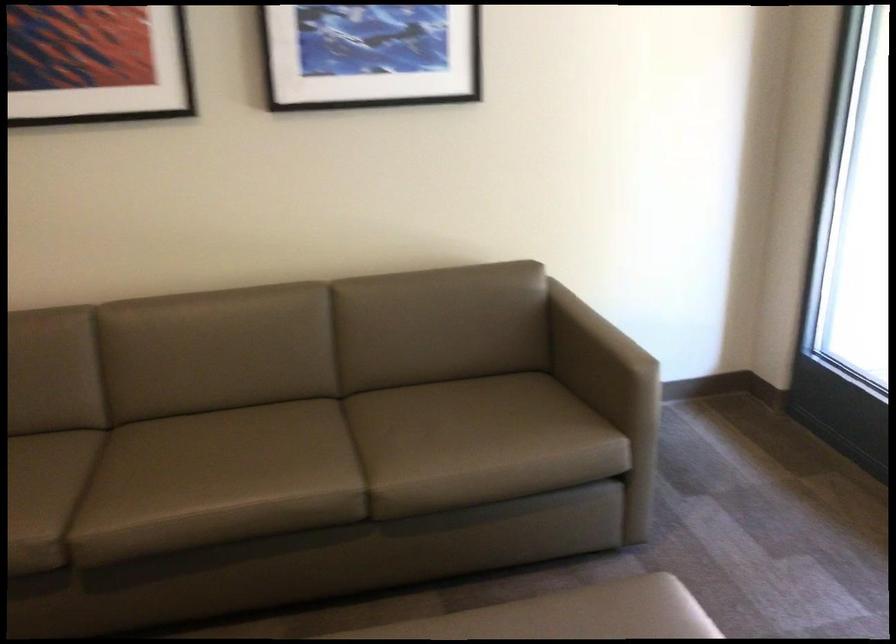
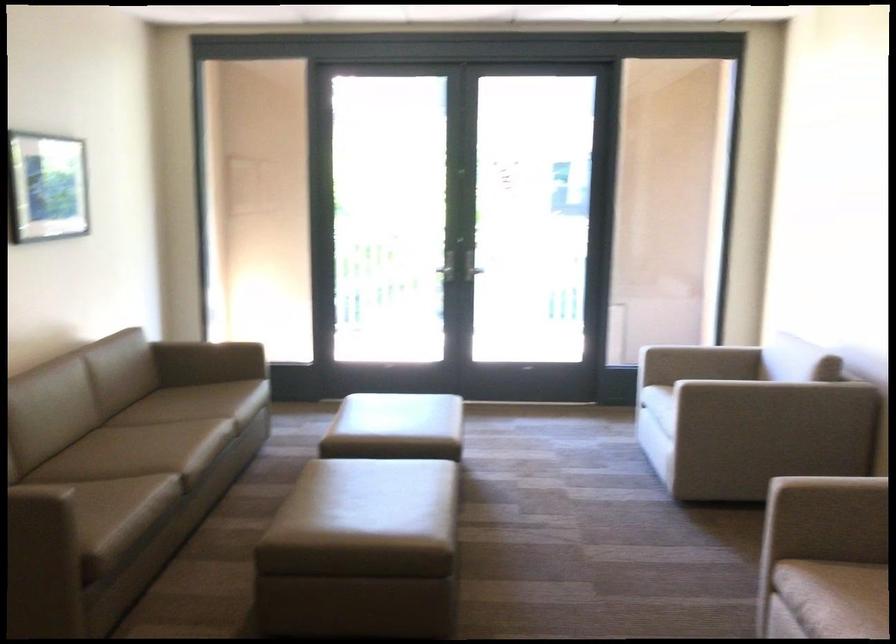
In the second image, find the point that corresponds to point (467, 379) in the first image.

(122, 399)